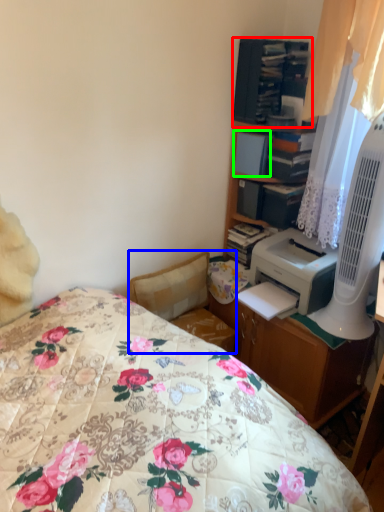
Question: Estimate the real-world distances between objects in this image. Which object is farther from shelf (highlighted by a red box), swivel chair (highlighted by a blue box) or book (highlighted by a green box)?

Choices:
 (A) swivel chair
 (B) book

Answer: (A)